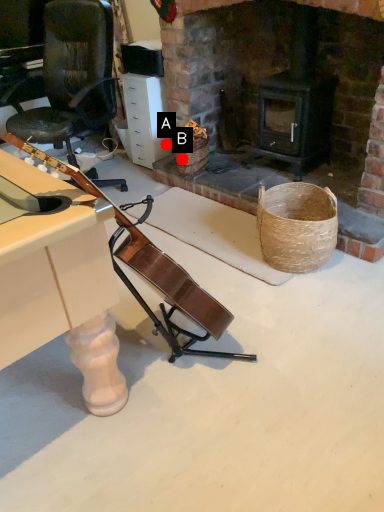
Question: Two points are circled on the image, labeled by A and B beside each circle. Which point appears closest to the camera in this image?

Choices:
 (A) A is closer
 (B) B is closer

Answer: (B)